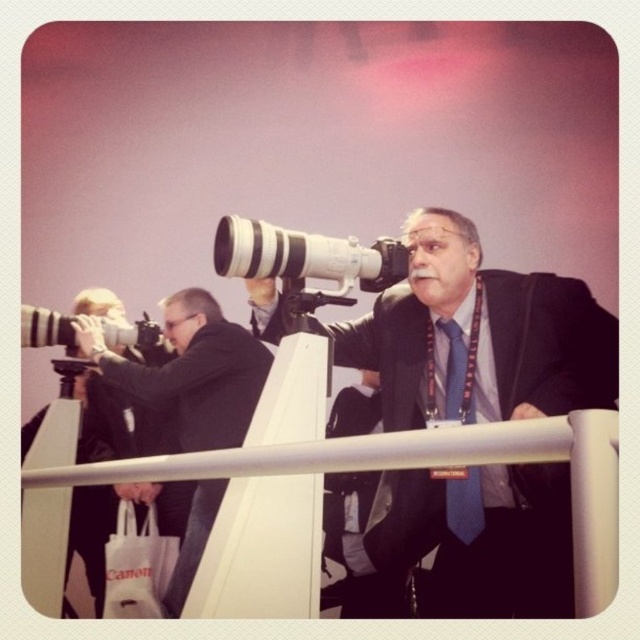
In the scene shown: Who is more forward, [548,417] or [176,344]?

Point [548,417] is in front.

Is point (308, 456) positioned in front of point (204, 330)?

That is True.

Between point (605, 499) and point (209, 346), which one is positioned behind?

The point (209, 346) is behind.

Where is `white metal rail at center`? The height and width of the screenshot is (640, 640). white metal rail at center is located at coordinates (426, 467).

Which is behind, point (380, 266) or point (481, 529)?

The point (481, 529) is more distant.

Between white plastic camera at center and blue textured tie at center, which one appears on the right side from the viewer's perspective?

Positioned to the right is blue textured tie at center.

Is point (388, 257) less distant than point (452, 323)?

Yes, point (388, 257) is closer to viewer.

Identify the location of white plastic camera at center. coord(305,260).

Who is more distant from viewer, (163, 477) or (369, 262)?

Positioned behind is point (369, 262).

Does white metal rail at center appear on the right side of white plastic camera at center?

No, white metal rail at center is not to the right of white plastic camera at center.

Who is more distant from viewer, (589, 518) or (362, 260)?

Positioned behind is point (362, 260).

Where is `white metal rail at center`? white metal rail at center is located at coordinates (426, 467).